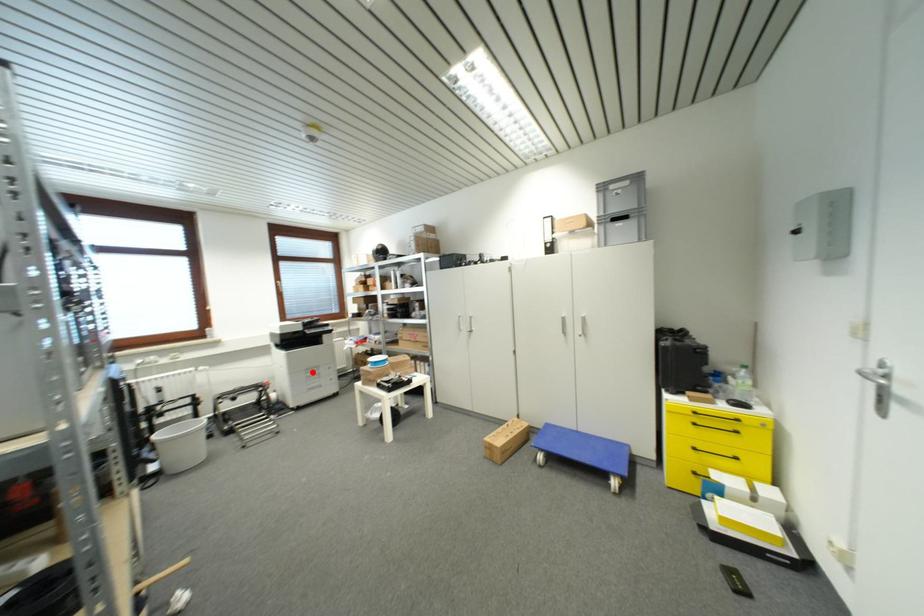
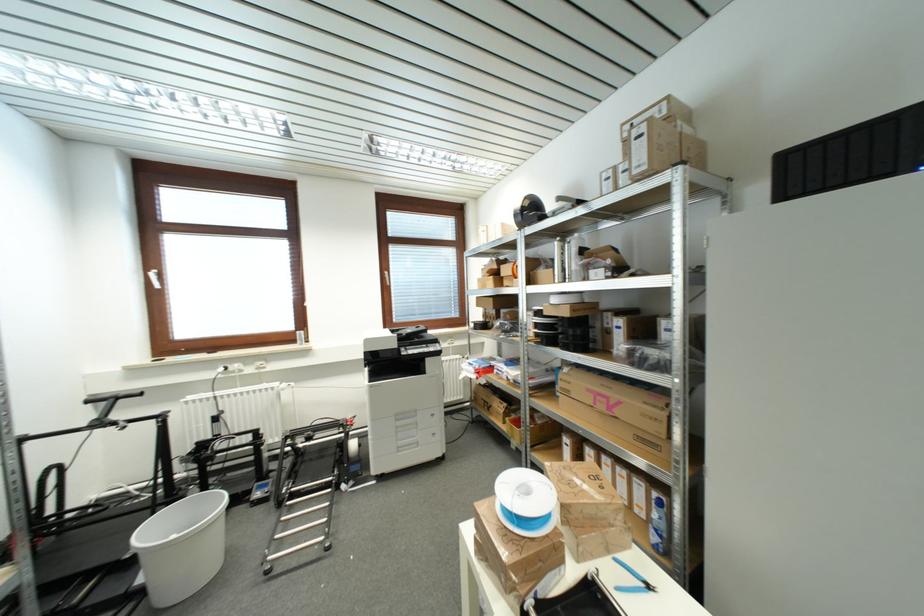
Question: I am providing you with two images of the same scene from different viewpoints. Given a red point in image1, look at the same physical point in image2. Is it:

Choices:
 (A) Closer to the viewpoint
 (B) Farther from the viewpoint

Answer: (B)